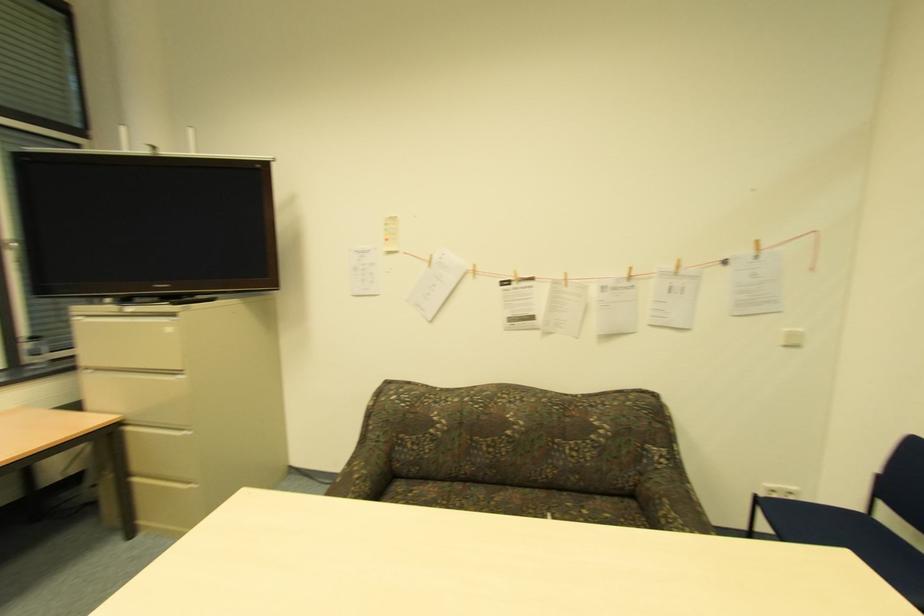
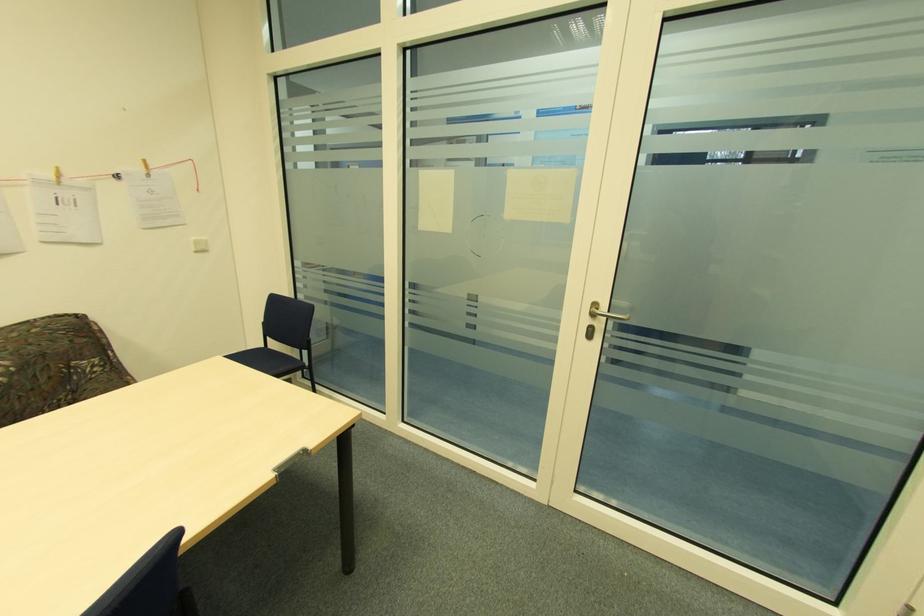
Question: The first image is from the beginning of the video and the second image is from the end. How did the camera likely rotate when shooting the video?

Choices:
 (A) Left
 (B) Right
 (C) Up
 (D) Down

Answer: (B)